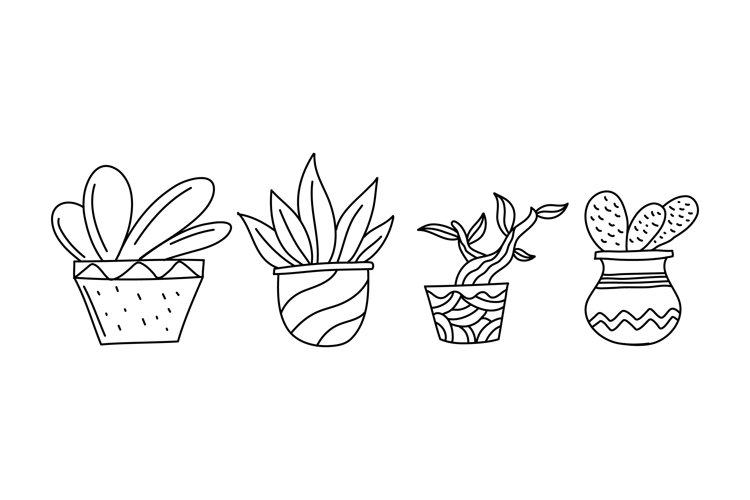
The height and width of the screenshot is (500, 750). What are the coordinates of `empty space below first vase` in the screenshot? It's located at (136, 375).